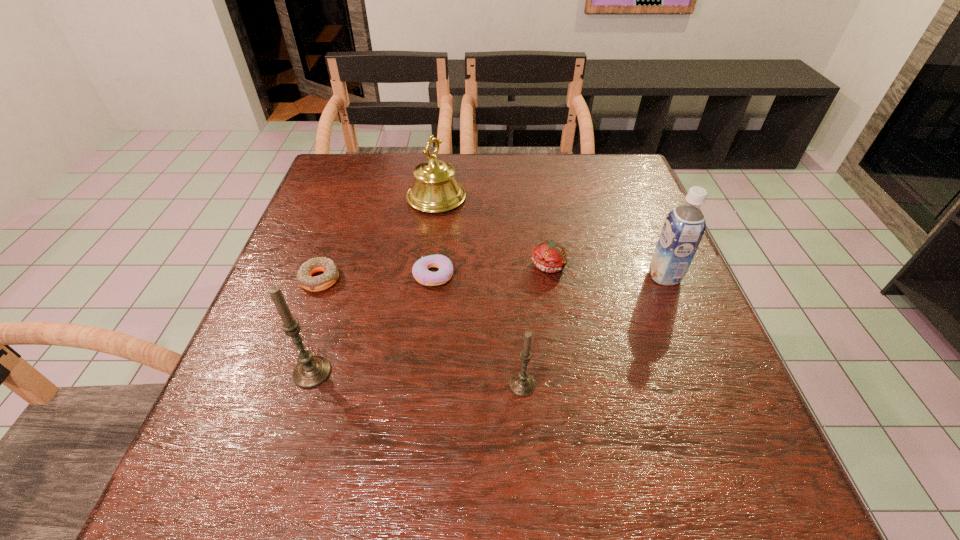
Image resolution: width=960 pixels, height=540 pixels. Identify the location of vacant region between the fifth shortest object and the third shortest object. (493, 232).

Locate an element on the screen. vacant space that's between the sixth object from left to right and the left candle is located at coordinates (431, 319).

You are a GUI agent. You are given a task and a screenshot of the screen. Output one action in this format:
    pyautogui.click(x=<x>, y=<y>)
    Task: Click on the vacant area between the sixth object from left to right and the farthest object
    
    Given the screenshot: What is the action you would take?
    pyautogui.click(x=493, y=232)

I want to click on vacant area that lies between the shorter candle and the right doughnut, so click(x=478, y=330).

At what (x,y) coordinates should I click in order to perform the action: click on free space between the right doughnut and the left candle. Please return your answer as a coordinate pair (x, y). Image resolution: width=960 pixels, height=540 pixels. Looking at the image, I should click on (372, 323).

Find the location of a particular element. free spot between the left candle and the bell is located at coordinates (374, 285).

In order to click on free space between the right candle and the bell in this screenshot , I will do `click(479, 292)`.

Find the location of a particular element. vacant area that lies between the left candle and the fifth shortest object is located at coordinates (374, 285).

Locate an element on the screen. unoccupied area between the right candle and the tomato is located at coordinates (536, 326).

The height and width of the screenshot is (540, 960). What are the coordinates of `unoccupied position between the soya milk and the fourth shortest object` in the screenshot? It's located at (593, 330).